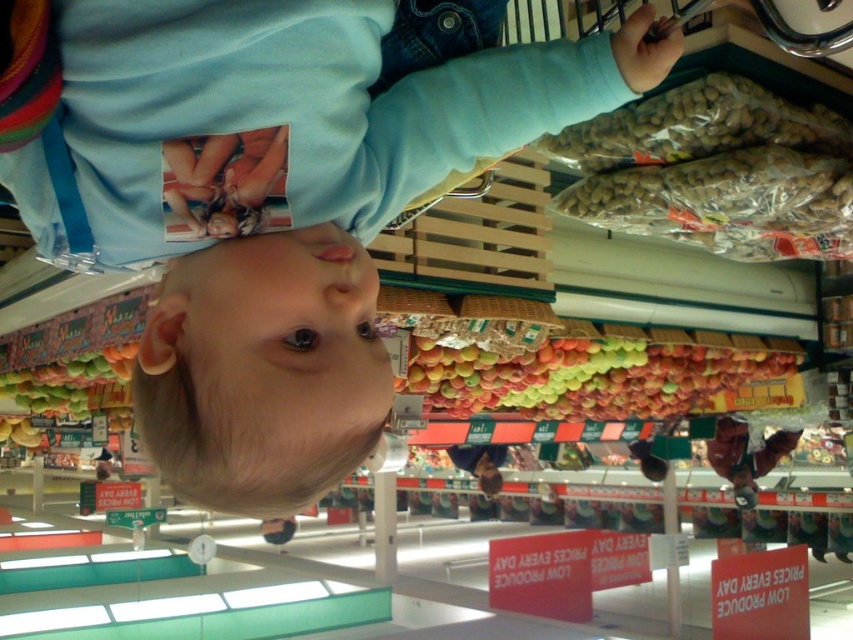
Question: Is blue cotton sweatshirt at upper center positioned before shiny red apples at center?

Choices:
 (A) no
 (B) yes

Answer: (B)

Question: Is blue cotton sweatshirt at upper center above shiny red apples at center?

Choices:
 (A) yes
 (B) no

Answer: (A)

Question: Among these objects, which one is farthest from the camera?

Choices:
 (A) shiny red apples at center
 (B) blue cotton sweatshirt at upper center

Answer: (A)

Question: Can you confirm if blue cotton sweatshirt at upper center is positioned below shiny red apples at center?

Choices:
 (A) yes
 (B) no

Answer: (B)